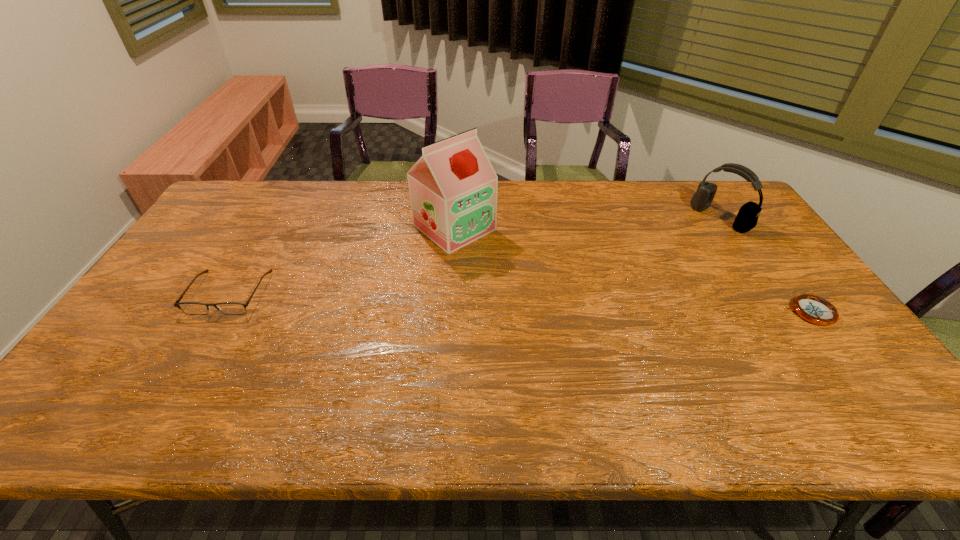
This screenshot has height=540, width=960. Identify the location of free space between the second object from left to right and the third tallest object. (342, 260).

Locate an element on the screen. vacant area that lies between the soya milk and the shortest object is located at coordinates (632, 270).

The image size is (960, 540). What are the coordinates of `free space that is in between the second tallest object and the third object from right to left` in the screenshot? It's located at (588, 222).

I want to click on free space between the leftmost object and the shortest object, so click(519, 302).

Find the location of a particular element. the closest object to the second object from left to right is located at coordinates pyautogui.click(x=231, y=308).

Identify which object is the second closest to the soya milk. Please provide its 2D coordinates. Your answer should be formatted as a tuple, i.e. [(x, y)], where the tuple contains the x and y coordinates of a point satisfying the conditions above.

[(747, 217)]

Image resolution: width=960 pixels, height=540 pixels. What are the coordinates of `vacant area in the image that satisfies the following two spatial constraints: 1. on the front-facing side of the third tallest object; 2. on the left side of the compass` in the screenshot? It's located at (218, 312).

This screenshot has height=540, width=960. In order to click on free point that satisfies the following two spatial constraints: 1. on the front-facing side of the third tallest object; 2. on the right side of the shortest object in this screenshot , I will do `click(218, 312)`.

This screenshot has height=540, width=960. What are the coordinates of `vacant position in the image that satisfies the following two spatial constraints: 1. on the front-facing side of the second shortest object; 2. on the right side of the compass` in the screenshot? It's located at (218, 312).

You are a GUI agent. You are given a task and a screenshot of the screen. Output one action in this format:
    pyautogui.click(x=<x>, y=<y>)
    Task: Click on the blank area in the image that satisfies the following two spatial constraints: 1. on the front side of the compass; 2. on the right side of the third object from right to left
    This screenshot has height=540, width=960.
    Given the screenshot: What is the action you would take?
    pos(448,312)